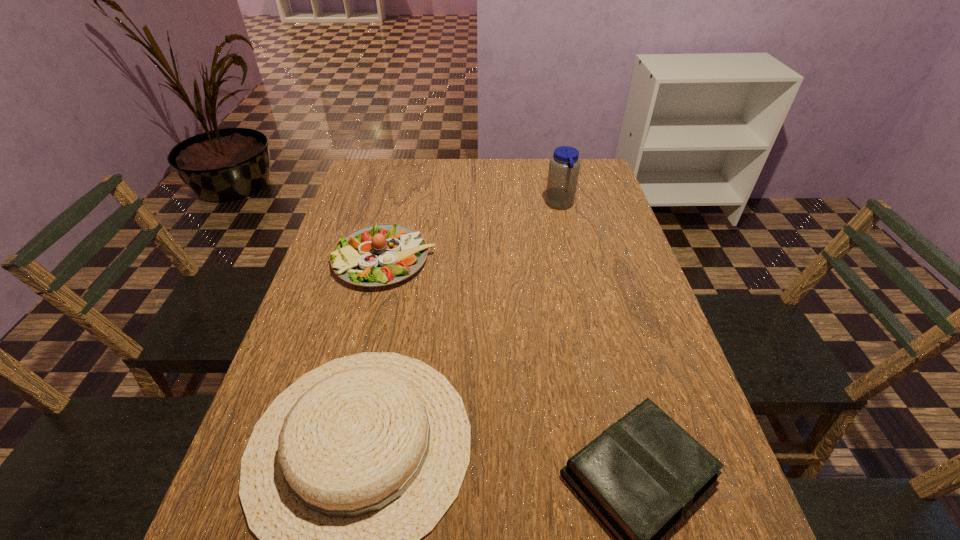
The image size is (960, 540). Find the location of `water bottle`. water bottle is located at coordinates (564, 165).

Locate an element on the screen. This screenshot has height=540, width=960. the farthest object is located at coordinates (564, 165).

Where is `the third nearest object`? This screenshot has height=540, width=960. the third nearest object is located at coordinates 378,255.

Identify the location of vacant space situated 0.130m with a carrying loop on the side of the tallest object. This screenshot has width=960, height=540. (506, 205).

Locate an element on the screen. free space located with a carrying loop on the side of the tallest object is located at coordinates (475, 205).

This screenshot has width=960, height=540. I want to click on vacant point located with a carrying loop on the side of the tallest object, so click(450, 205).

Locate an element on the screen. This screenshot has width=960, height=540. free spot located on the back of the salad plate is located at coordinates (396, 210).

Locate an element on the screen. object that is positioned at the left edge is located at coordinates (378, 255).

At what (x,y) coordinates should I click in order to perform the action: click on object that is at the right edge. Please return your answer as a coordinate pair (x, y). Looking at the image, I should click on (564, 165).

Where is `vacant area at the far edge`? This screenshot has height=540, width=960. vacant area at the far edge is located at coordinates (483, 183).